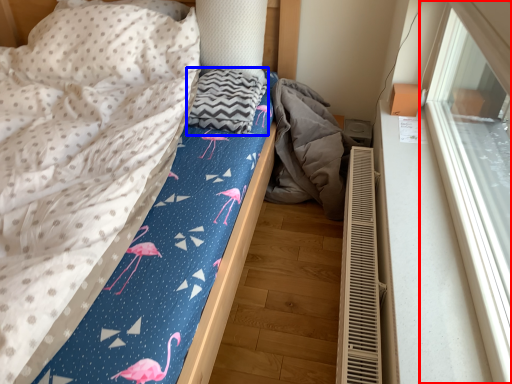
Question: Which object appears farthest to the camera in this image, window (highlighted by a red box) or blanket (highlighted by a blue box)?

Choices:
 (A) window
 (B) blanket

Answer: (B)